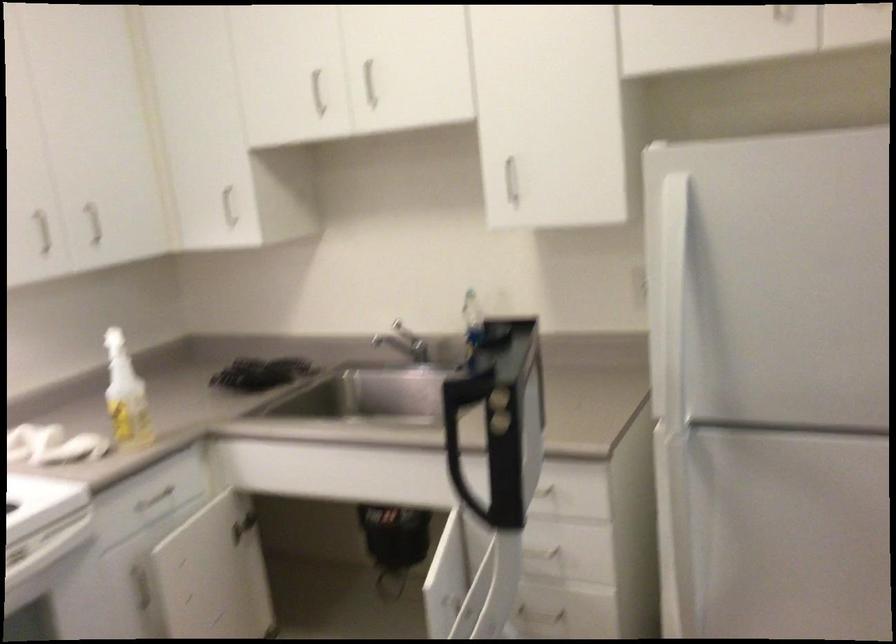
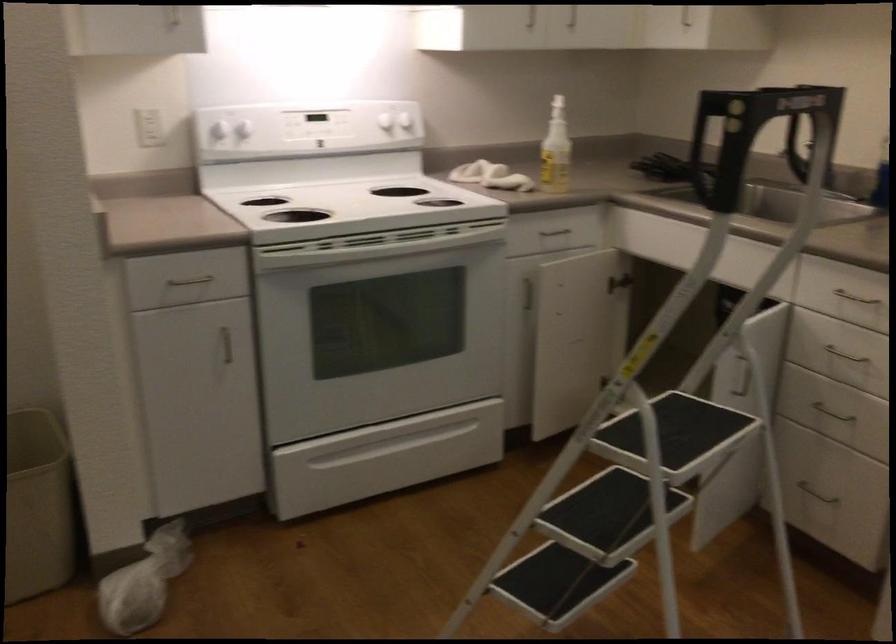
Question: Based on the continuous images, in which direction is the camera rotating? Reply with the corresponding letter.

Choices:
 (A) Left
 (B) Right
 (C) Up
 (D) Down

Answer: (A)